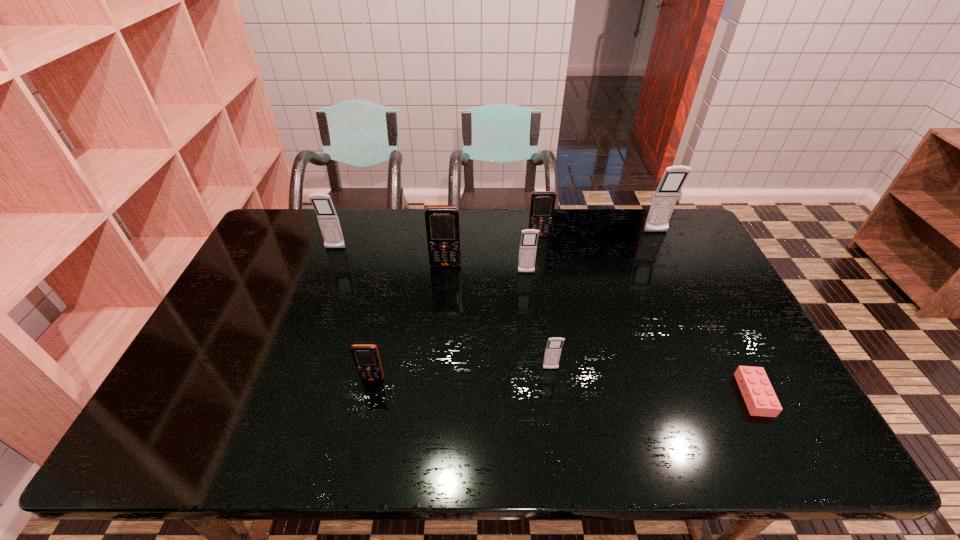
Where is `free point between the third cellular telephone from left to right and the sixth cellular telephone from right to left`? The image size is (960, 540). free point between the third cellular telephone from left to right and the sixth cellular telephone from right to left is located at coordinates (409, 322).

Find the location of a particular element. object that is the seventh closest to the nearest gray cellular telephone is located at coordinates (327, 217).

At what (x,y) coordinates should I click in order to perform the action: click on the fifth closest object relative to the nearest orange cellular telephone. Please return your answer as a coordinate pair (x, y). Looking at the image, I should click on coord(542,205).

Locate which cellular telephone ranks fifth in proximity to the second cellular telephone from left to right. Please provide its 2D coordinates. Your answer should be formatted as a tuple, i.e. [(x, y)], where the tuple contains the x and y coordinates of a point satisfying the conditions above.

[(542, 205)]

This screenshot has height=540, width=960. I want to click on cellular telephone that stands as the fifth closest to the third farthest object, so click(x=553, y=349).

Choose which gray cellular telephone is the fourth nearest neighbor to the shortest object. Please provide its 2D coordinates. Your answer should be formatted as a tuple, i.e. [(x, y)], where the tuple contains the x and y coordinates of a point satisfying the conditions above.

[(327, 217)]

Find the location of a particular element. The width and height of the screenshot is (960, 540). the second closest gray cellular telephone to the nearest gray cellular telephone is located at coordinates (665, 197).

This screenshot has height=540, width=960. Find the location of `orange cellular telephone that stands as the closest to the second nearest gray cellular telephone`. orange cellular telephone that stands as the closest to the second nearest gray cellular telephone is located at coordinates (542, 205).

I want to click on orange cellular telephone that is the second closest to the leftmost cellular telephone, so click(x=366, y=358).

You are a GUI agent. You are given a task and a screenshot of the screen. Output one action in this format:
    pyautogui.click(x=<x>, y=<y>)
    Task: Click on the vacant space that satisfies the following two spatial constraints: 1. on the front-facing side of the shortest object; 2. on the left side of the leftmost cellular telephone
    The width and height of the screenshot is (960, 540).
    Given the screenshot: What is the action you would take?
    pyautogui.click(x=280, y=395)